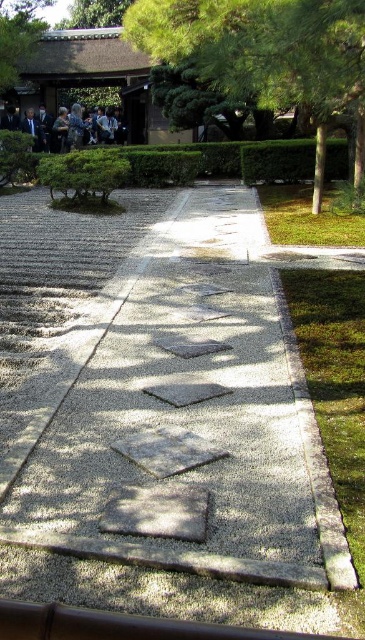
Measure the distance between green leafy tree at upper right and dark gray suit at upper left.

green leafy tree at upper right is 38.83 feet from dark gray suit at upper left.

Can you confirm if green leafy tree at upper right is taller than dark gray suit at upper left?

No.

Which is behind, point (350, 97) or point (101, 131)?

Point (101, 131)

Image resolution: width=365 pixels, height=640 pixels. Find the location of `green leafy tree at upper right`. green leafy tree at upper right is located at coordinates (267, 54).